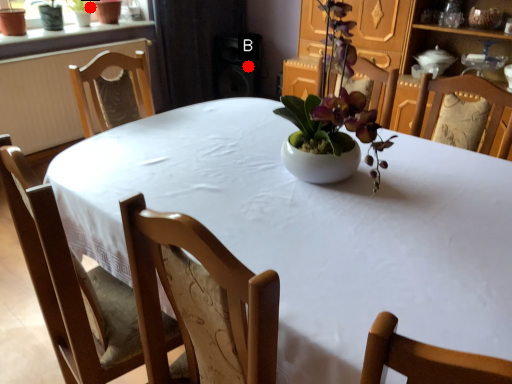
Question: Two points are circled on the image, labeled by A and B beside each circle. Among these points, which one is nearest to the camera?

Choices:
 (A) A is closer
 (B) B is closer

Answer: (A)